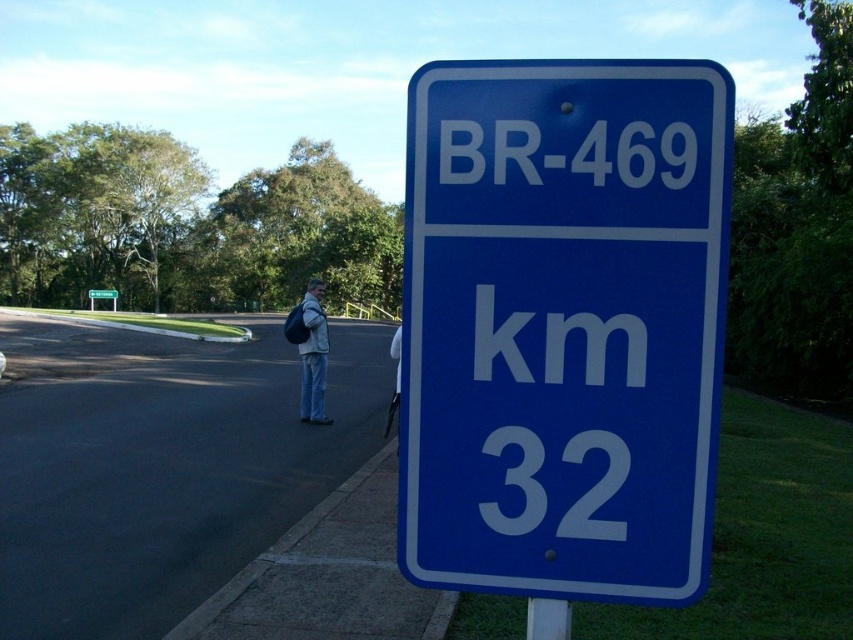
You are a pedestrian standing at the roadside and want to check the blue metallic sign at center. Which direction should you move relative to the blue plastic pole at lower center to reach it?

The blue metallic sign at center is to the left of the blue plastic pole at lower center, so you should move to the left relative to the blue plastic pole at lower center to reach it.